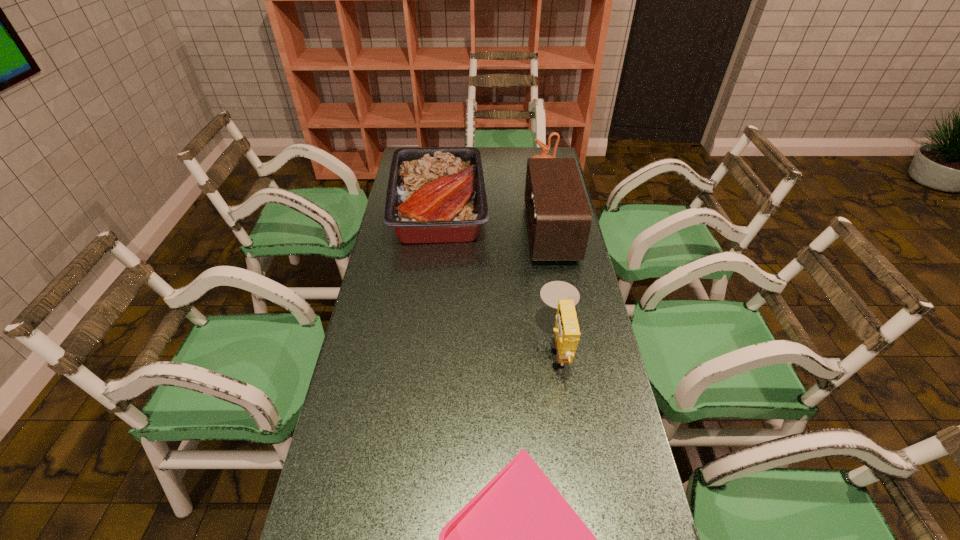
You are a GUI agent. You are given a task and a screenshot of the screen. Output one action in this format:
    pyautogui.click(x=<x>, y=<y>)
    Task: Click on the radio receiver
    Image resolution: width=960 pixels, height=540 pixels.
    Given the screenshot: What is the action you would take?
    pyautogui.click(x=559, y=218)

Locate an element on the screen. pottery is located at coordinates (545, 148).

This screenshot has width=960, height=540. What are the coordinates of `sponge` in the screenshot? It's located at (560, 295).

Where is `tray`? Image resolution: width=960 pixels, height=540 pixels. tray is located at coordinates (435, 195).

Identify the location of vacant space situated 0.400m on the front-facing side of the radio receiver. (423, 232).

Identify the location of free spot located on the front-facing side of the radio receiver. (432, 232).

You are a GUI agent. You are given a task and a screenshot of the screen. Output one action in this format:
    pyautogui.click(x=<x>, y=<y>)
    Task: Click on the vacant space located on the front-facing side of the radio receiver
    The width and height of the screenshot is (960, 540).
    Given the screenshot: What is the action you would take?
    pyautogui.click(x=512, y=232)

What are the coordinates of `free location located on the spout of the pottery` in the screenshot? It's located at (484, 176).

Find the location of `free space located 0.250m on the spout of the pottery`. free space located 0.250m on the spout of the pottery is located at coordinates (473, 176).

Where is `free space located 0.350m on the spout of the pottery`? The image size is (960, 540). free space located 0.350m on the spout of the pottery is located at coordinates (451, 176).